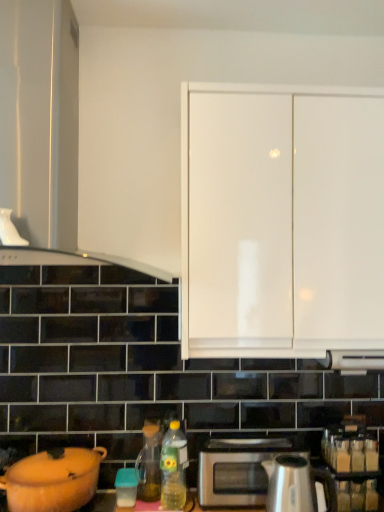
Question: Should I look upward or downward to see matte orange pot at lower left, acting as the 1th kitchen appliance starting from the left?

Choices:
 (A) down
 (B) up

Answer: (A)

Question: From a real-world perspective, is matte orange pot at lower left, the second kitchen appliance in the right-to-left sequence, on matte glass tea pot at lower center?

Choices:
 (A) no
 (B) yes

Answer: (A)

Question: Can you confirm if matte orange pot at lower left, the second kitchen appliance in the right-to-left sequence, is positioned to the right of matte glass tea pot at lower center?

Choices:
 (A) no
 (B) yes

Answer: (A)

Question: Can you confirm if matte orange pot at lower left, acting as the 1th kitchen appliance starting from the left, is shorter than matte glass tea pot at lower center?

Choices:
 (A) no
 (B) yes

Answer: (B)

Question: From the image's perspective, would you say matte orange pot at lower left, the second kitchen appliance in the right-to-left sequence, is positioned over matte glass tea pot at lower center?

Choices:
 (A) no
 (B) yes

Answer: (B)

Question: Is matte orange pot at lower left, the second kitchen appliance in the right-to-left sequence, aimed at matte glass tea pot at lower center?

Choices:
 (A) no
 (B) yes

Answer: (A)

Question: Is matte orange pot at lower left, acting as the 1th kitchen appliance starting from the left, positioned before matte glass tea pot at lower center?

Choices:
 (A) no
 (B) yes

Answer: (B)

Question: Is polished stainless steel kettle at lower center, which appears as the first kitchen appliance when viewed from the right, further to the viewer compared to white glossy cabinet at upper left, which is the 1th cabinetry from left to right?

Choices:
 (A) no
 (B) yes

Answer: (B)

Question: Considering the relative positions of polished stainless steel kettle at lower center, which appears as the first kitchen appliance when viewed from the right, and white glossy cabinet at upper left, which appears as the second cabinetry when viewed from the right, in the image provided, is polished stainless steel kettle at lower center, which appears as the first kitchen appliance when viewed from the right, to the left of white glossy cabinet at upper left, which appears as the second cabinetry when viewed from the right, from the viewer's perspective?

Choices:
 (A) no
 (B) yes

Answer: (A)

Question: Considering the relative sizes of polished stainless steel kettle at lower center, arranged as the second kitchen appliance when viewed from the left, and white glossy cabinet at upper left, which is the 1th cabinetry from left to right, in the image provided, is polished stainless steel kettle at lower center, arranged as the second kitchen appliance when viewed from the left, bigger than white glossy cabinet at upper left, which is the 1th cabinetry from left to right,?

Choices:
 (A) no
 (B) yes

Answer: (A)

Question: Considering the relative positions of polished stainless steel kettle at lower center, which appears as the first kitchen appliance when viewed from the right, and white glossy cabinet at upper left, which appears as the second cabinetry when viewed from the right, in the image provided, is polished stainless steel kettle at lower center, which appears as the first kitchen appliance when viewed from the right, in front of white glossy cabinet at upper left, which appears as the second cabinetry when viewed from the right,?

Choices:
 (A) no
 (B) yes

Answer: (A)

Question: Is polished stainless steel kettle at lower center, arranged as the second kitchen appliance when viewed from the left, thinner than white glossy cabinet at upper left, which is the 1th cabinetry from left to right?

Choices:
 (A) yes
 (B) no

Answer: (A)

Question: Are polished stainless steel kettle at lower center, arranged as the second kitchen appliance when viewed from the left, and white glossy cabinet at upper left, which appears as the second cabinetry when viewed from the right, located far from each other?

Choices:
 (A) no
 (B) yes

Answer: (B)

Question: Is satin silver microwave at lower center bigger than matte glass tea pot at lower center?

Choices:
 (A) no
 (B) yes

Answer: (B)